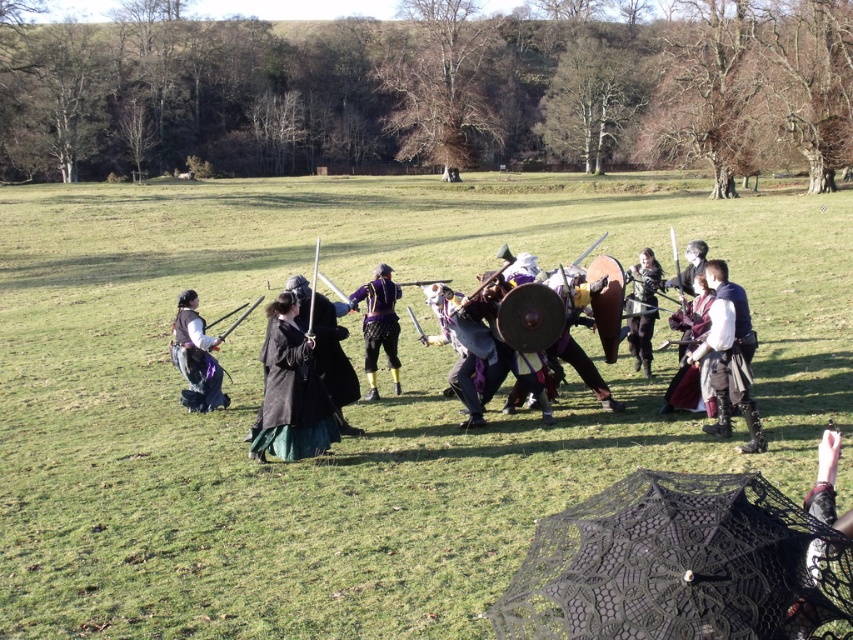
You are a participant in the mock battle and need to retrieve your matte leather armor at center. You are currently standing behind the dark gray woolen cloak at center. Can you reach your armor without moving past the cloak?

The matte leather armor at center is behind the dark gray woolen cloak at center, so you cannot reach it without moving past the cloak.